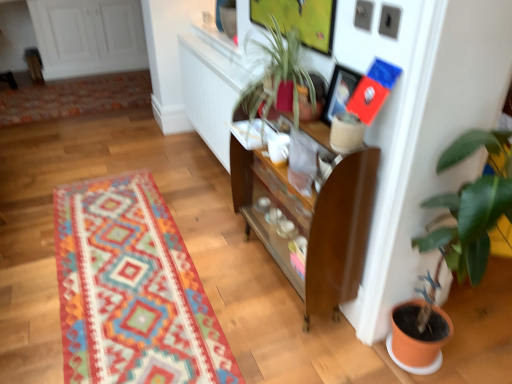
Question: In terms of size, does green glossy plant at right appear bigger or smaller than multicolored woven rug at center, which appears as the second mat when viewed from the back?

Choices:
 (A) big
 (B) small

Answer: (A)

Question: In terms of height, does green glossy plant at right look taller or shorter compared to multicolored woven rug at center, which appears as the second mat when viewed from the back?

Choices:
 (A) tall
 (B) short

Answer: (A)

Question: Estimate the real-world distances between objects in this image. Which object is farther from the multicolored woven rug at upper left, marked as the 2th mat in a bottom-to-top arrangement?

Choices:
 (A) green glossy plant at right
 (B) matte black picture frame at upper center
 (C) multicolored woven rug at center, which ranks as the first mat in front-to-back order
 (D) brown wood cabinet at center
 (E) white glossy coffee cup at center

Answer: (A)

Question: Considering the real-world distances, which object is farthest from the green glossy plant at right?

Choices:
 (A) matte black picture frame at upper center
 (B) multicolored woven rug at center, positioned as the 1th mat in bottom-to-top order
 (C) white glossy coffee cup at center
 (D) brown wood cabinet at center
 (E) multicolored woven rug at upper left, the 2th mat in the front-to-back sequence

Answer: (E)